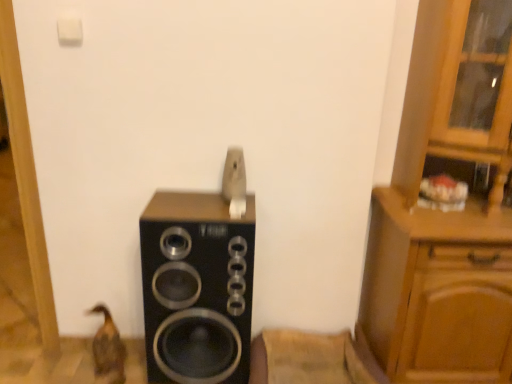
Question: From a real-world perspective, is brown matte duck at lower left physically located above or below black matte speaker at center?

Choices:
 (A) below
 (B) above

Answer: (A)

Question: Is point (103, 334) positioned closer to the camera than point (196, 213)?

Choices:
 (A) closer
 (B) farther

Answer: (B)

Question: Based on their relative distances, which object is nearer to the black matte speaker at center?

Choices:
 (A) brown matte duck at lower left
 (B) wooden cabinet at right

Answer: (A)

Question: Based on their relative distances, which object is farther from the black matte speaker at center?

Choices:
 (A) wooden cabinet at right
 (B) brown matte duck at lower left

Answer: (A)